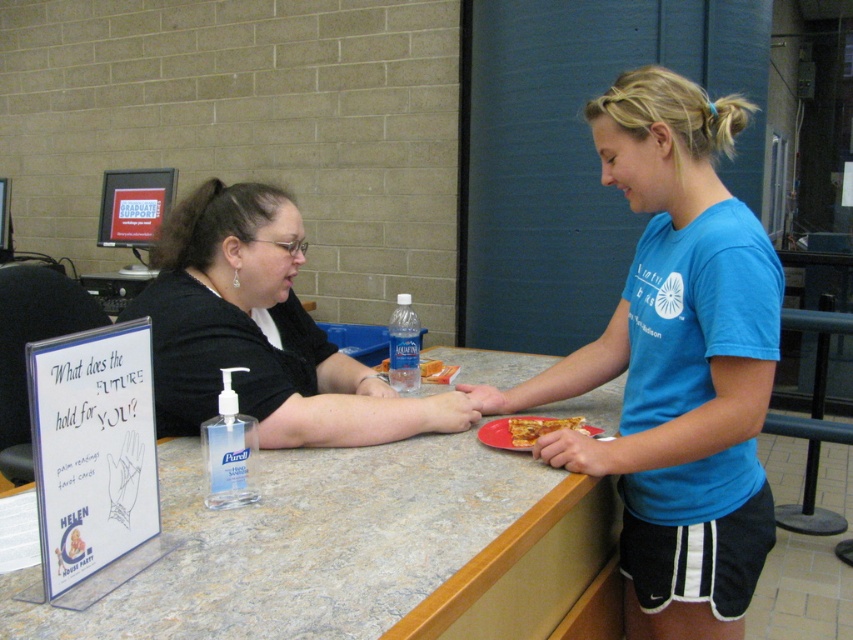
You are a customer at the counter and want to grab the golden crispy pizza slice at center. Can you reach it without moving the black fabric shirt at center?

The black fabric shirt at center is in front of the golden crispy pizza slice at center, so you cannot reach the pizza slice without moving the shirt first.

You are a customer standing at the counter and want to hand over a blue cotton shirt at center to the woman behind the counter. Where should you place it so that she can easily reach it?

Place the blue cotton shirt at center at the coordinates point (676, 364) so the woman can easily reach it.